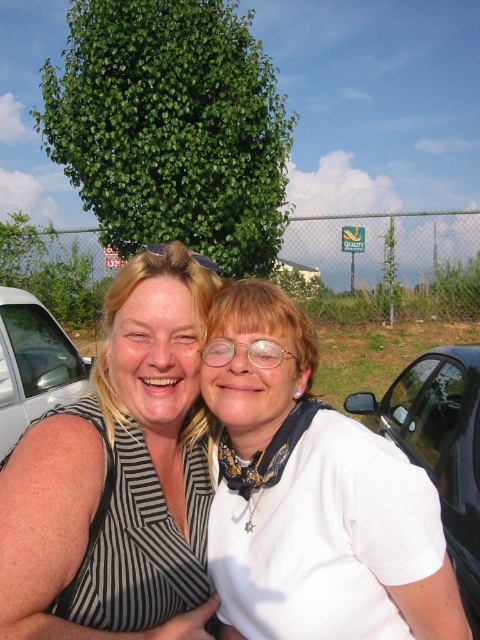
You are a photographer standing in front of the striped fabric at center and the white glossy car at left. You want to take a photo of the Quality Inn sign in the background. Which object should you move closer to in order to get a clearer view of the sign?

You should move closer to the white glossy car at left because the striped fabric at center is closer to you, blocking your view of the Quality Inn sign in the background.

You are a photographer trying to capture a photo of the white glossy car at left and the white matte shirt at center. Since both are white, you want to ensure you can distinguish them in the final image. Based on their positions, which object should appear lower in the photo?

The white matte shirt at center is located below the white glossy car at left, so in the photo, the white matte shirt at center will appear lower than the white glossy car at left.